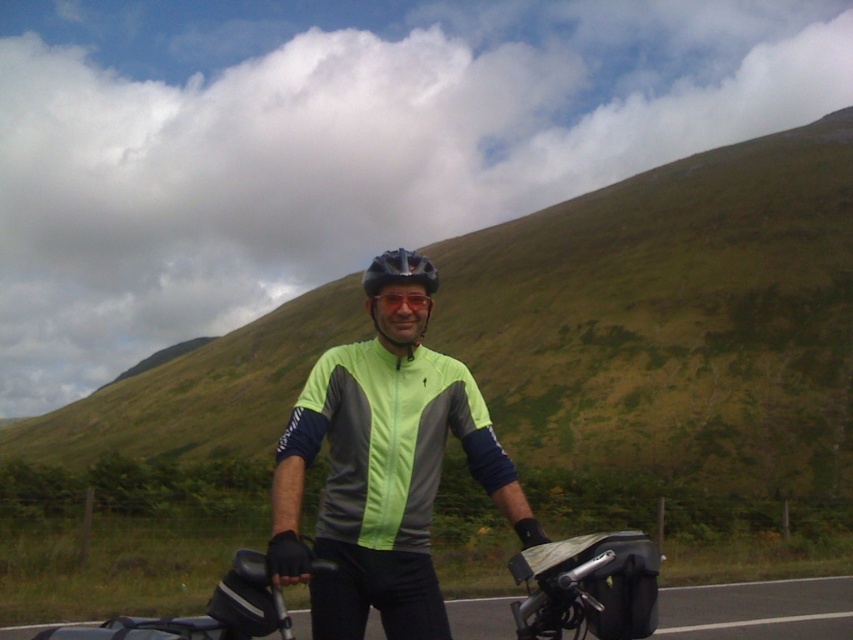
You are a cyclist who just noticed that your black textured bag at center and matte black helmet at center are positioned in a way that might block your view while riding. Based on their positions, which item is more likely to obstruct your forward view?

The black textured bag at center is to the right of the matte black helmet at center. Since the bag is positioned further to the right, it might be less likely to block your forward view compared to the matte black helmet at center which is directly in front.

You are a photographer trying to capture the cyclist in a way that highlights both the neon green fabric jacket at center and the matte black helmet at center. Since you want to ensure both are visible, which object should you focus on first considering their heights?

The neon green fabric jacket at center has a lesser height compared to matte black helmet at center, so you should focus on the matte black helmet at center first to ensure both are in focus.

You are a photographer trying to capture the cyclist and their gear. You want to ensure the neon green fabric jacket at center and the matte black helmet at center are both clearly visible in the photo. Based on their positions, which object should you focus on first to ensure both are in frame?

The neon green fabric jacket at center is to the right of the matte black helmet at center. To ensure both are in frame, focus on the matte black helmet at center first since it is on the left, allowing you to adjust the frame to include the jacket on the right.